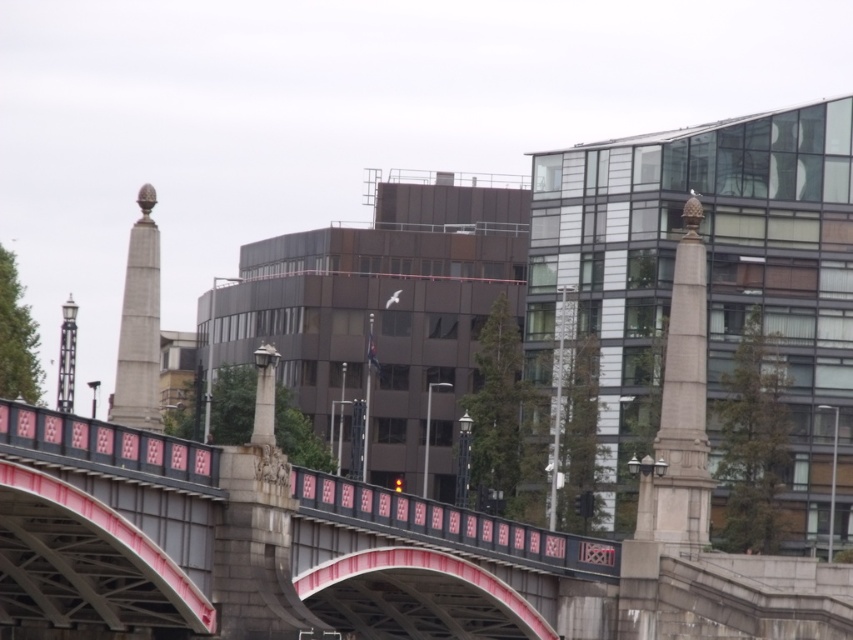
In the scene shown: Which of these two, metallic bridge at center or smooth stone obelisk at left, stands shorter?

metallic bridge at center is shorter.

Does point (0, 419) come farther from viewer compared to point (137, 346)?

No, it is in front of (137, 346).

Where is `metallic bridge at center`? This screenshot has width=853, height=640. metallic bridge at center is located at coordinates (428, 564).